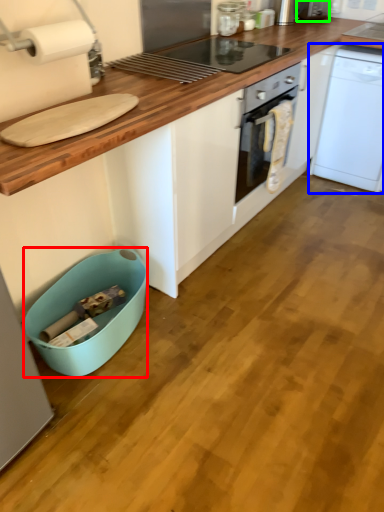
Question: Based on their relative distances, which object is farther from dish washer (highlighted by a red box)? Choose from home appliance (highlighted by a blue box) and appliance (highlighted by a green box).

Choices:
 (A) home appliance
 (B) appliance

Answer: (B)